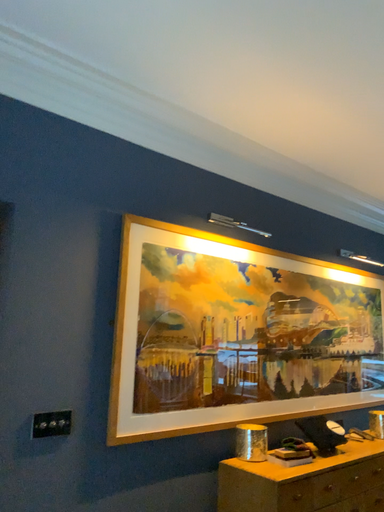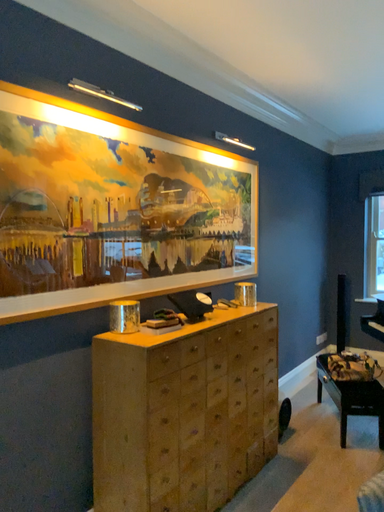
Question: Which way did the camera rotate in the video?

Choices:
 (A) rotated left
 (B) rotated right

Answer: (B)